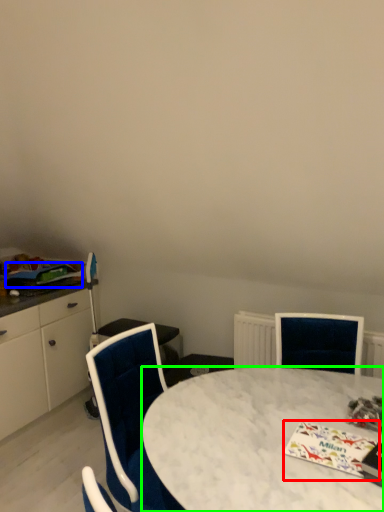
Question: Considering the real-world distances, which object is farthest from magazine (highlighted by a red box)? magazine (highlighted by a blue box) or desk (highlighted by a green box)?

Choices:
 (A) magazine
 (B) desk

Answer: (A)